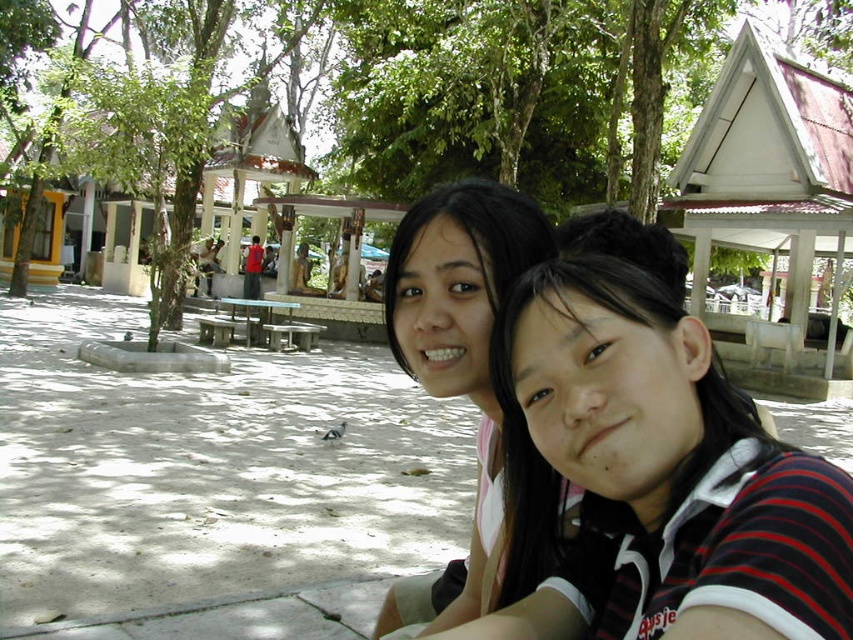
You are planning to place a picnic blanket between the two green leafy tree at center. Is there enough space between them to fit a picnic blanket that requires 10 meters of space?

The two green leafy tree at center are 9.16 meters apart, which is slightly less than the required 10 meters for the picnic blanket. Therefore, there isn not enough space between them to fit the picnic blanket.

You are a photographer trying to capture a photo of the matte black shirt at center and the green leafy tree at center. Since both are at the center, can you tell me which one is positioned to the right?

The matte black shirt at center is to the right of green leafy tree at center, so the matte black shirt at center is positioned to the right.

You are a photographer trying to capture a clear shot of the matte black shirt at center and the green leafy tree at center. Which object is closer to the camera?

The matte black shirt at center is in front of the green leafy tree at center, so the matte black shirt at center is closer to the camera.